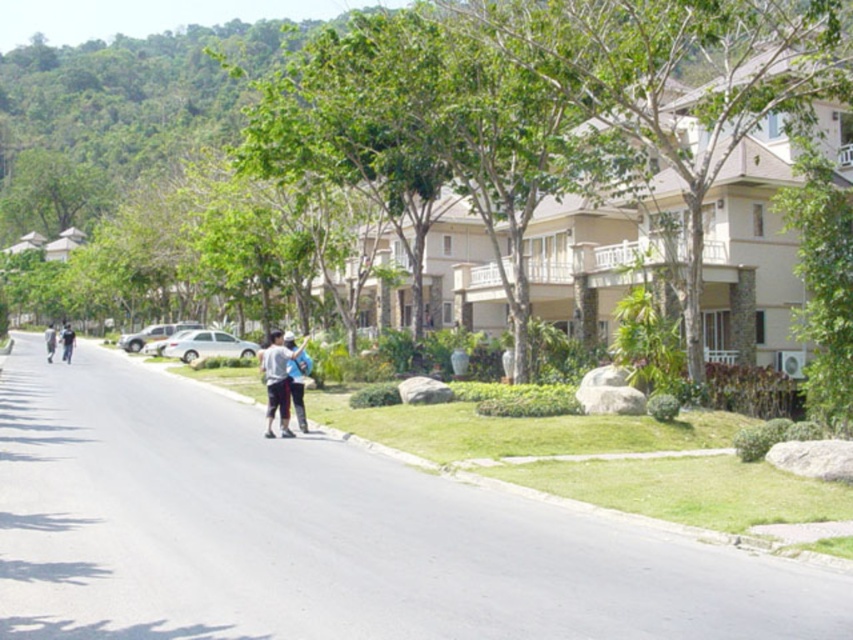
Question: Can you confirm if blue denim jeans at center is bigger than dark gray pants at left?

Choices:
 (A) no
 (B) yes

Answer: (A)

Question: Which object is the closest to the light gray fabric pants at center?

Choices:
 (A) light gray fabric couple at center
 (B) dark gray pants at left

Answer: (A)

Question: Which object is positioned closest to the dark gray pants at left?

Choices:
 (A) light gray fabric pants at center
 (B) light blue fabric shirt at center
 (C) blue denim jeans at center

Answer: (A)

Question: Is light gray fabric couple at center closer to the viewer compared to light gray fabric pants at center?

Choices:
 (A) yes
 (B) no

Answer: (B)

Question: Can you confirm if light gray fabric couple at center is positioned above dark gray pants at left?

Choices:
 (A) yes
 (B) no

Answer: (A)

Question: Among these objects, which one is farthest from the camera?

Choices:
 (A) dark gray pants at left
 (B) light blue fabric shirt at center
 (C) light gray fabric pants at center

Answer: (A)